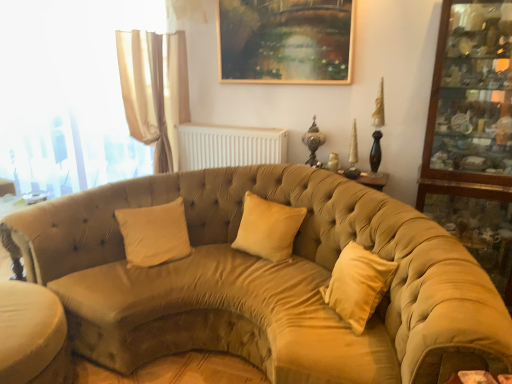
Question: Can you see velvet beige couch at center touching translucent fabric curtain at left?

Choices:
 (A) yes
 (B) no

Answer: (B)

Question: Is velvet beige couch at center bigger than translucent fabric curtain at left?

Choices:
 (A) no
 (B) yes

Answer: (B)

Question: From a real-world perspective, is velvet beige couch at center positioned under translucent fabric curtain at left based on gravity?

Choices:
 (A) yes
 (B) no

Answer: (A)

Question: Does velvet beige couch at center have a lesser width compared to translucent fabric curtain at left?

Choices:
 (A) no
 (B) yes

Answer: (A)

Question: From the image's perspective, would you say velvet beige couch at center is positioned over translucent fabric curtain at left?

Choices:
 (A) no
 (B) yes

Answer: (A)

Question: Is velvet beige couch at center positioned with its back to translucent fabric curtain at left?

Choices:
 (A) yes
 (B) no

Answer: (B)

Question: Considering the relative positions of suede-like beige pillow at center, acting as the 2th pillow starting from the left, and white plastic radiator at upper center in the image provided, is suede-like beige pillow at center, acting as the 2th pillow starting from the left, behind white plastic radiator at upper center?

Choices:
 (A) yes
 (B) no

Answer: (B)

Question: From a real-world perspective, is suede-like beige pillow at center, the 1th pillow in the right-to-left sequence, located higher than white plastic radiator at upper center?

Choices:
 (A) no
 (B) yes

Answer: (A)

Question: Is suede-like beige pillow at center, the 1th pillow in the right-to-left sequence, smaller than white plastic radiator at upper center?

Choices:
 (A) yes
 (B) no

Answer: (A)

Question: Can we say suede-like beige pillow at center, the 1th pillow in the right-to-left sequence, lies outside white plastic radiator at upper center?

Choices:
 (A) yes
 (B) no

Answer: (A)

Question: Is suede-like beige pillow at center, acting as the 2th pillow starting from the left, shorter than white plastic radiator at upper center?

Choices:
 (A) yes
 (B) no

Answer: (B)

Question: Is suede-like beige pillow at center, the 1th pillow in the right-to-left sequence, thinner than white plastic radiator at upper center?

Choices:
 (A) yes
 (B) no

Answer: (B)

Question: From a real-world perspective, is wooden glass cabinet at right below beige velvet pillow at center, the first pillow in the left-to-right sequence?

Choices:
 (A) yes
 (B) no

Answer: (B)